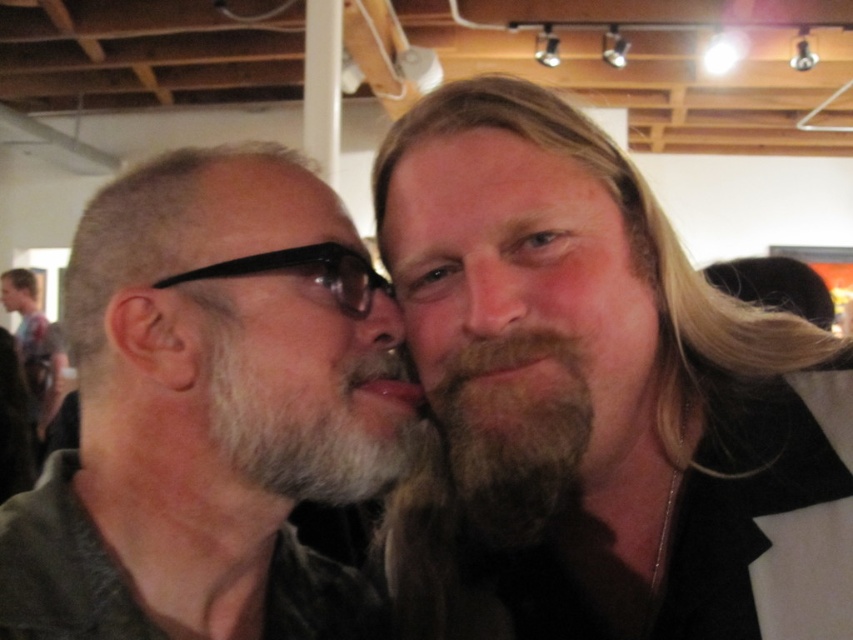
You are standing in the gallery and want to take a photo of the dark brown hair at center without getting too close. If your camera can focus clearly up to 20 inches away, will you need to move closer?

The dark brown hair at center is 18.12 inches away from the viewer. Since your camera can focus up to 20 inches, you do not need to move closer.

You are a photographer trying to capture a closeup shot of both beards in the scene. Since your camera can only focus on one beard at a time, which beard would you choose to ensure the entire beard fits within the frame if the dark brown fuzzy beard at center is narrower than the gray matte beard at center?

You should choose the dark brown fuzzy beard at center because its width is less than the gray matte beard at center, meaning it will fit better within the camera frame.

You are a photographer who needs to capture both beards in a single frame. Given that the dark brown fuzzy beard at center and the gray matte beard at center are both at the center, but one is smaller than the other, which beard should you focus on to ensure both are visible in the photo?

The dark brown fuzzy beard at center has a smaller size compared to gray matte beard at center. To ensure both are visible in the photo, focus on the gray matte beard at center as it is larger, allowing the smaller dark brown fuzzy beard at center to also fit within the frame.